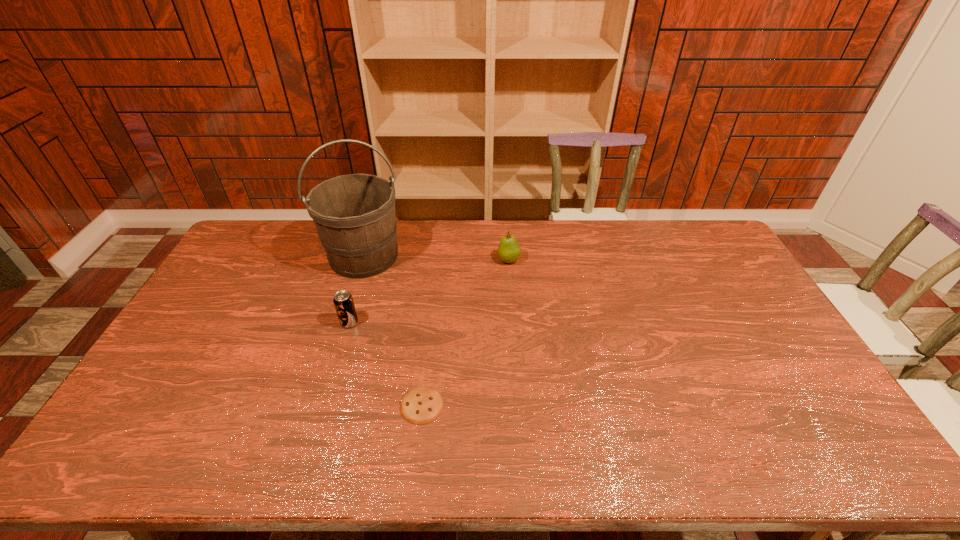
The height and width of the screenshot is (540, 960). I want to click on empty space that is in between the tallest object and the soda can, so click(357, 289).

Where is `vacant area that lies between the third farthest object and the third object from left to right`? The image size is (960, 540). vacant area that lies between the third farthest object and the third object from left to right is located at coordinates click(x=386, y=364).

You are a GUI agent. You are given a task and a screenshot of the screen. Output one action in this format:
    pyautogui.click(x=<x>, y=<y>)
    Task: Click on the vacant space in between the pear and the nearest object
    This screenshot has width=960, height=540.
    Given the screenshot: What is the action you would take?
    pyautogui.click(x=466, y=333)

Identify the location of free area in between the tallest object and the rightmost object. (437, 258).

Locate an element on the screen. vacant region between the shortest object and the tallest object is located at coordinates (393, 330).

The image size is (960, 540). I want to click on empty space that is in between the nearest object and the bucket, so click(x=393, y=330).

The height and width of the screenshot is (540, 960). In order to click on free space between the pear and the tallest object in this screenshot , I will do `click(437, 258)`.

Select which object is the second closest to the second object from right to left. Please provide its 2D coordinates. Your answer should be formatted as a tuple, i.e. [(x, y)], where the tuple contains the x and y coordinates of a point satisfying the conditions above.

[(354, 214)]

Select which object is the third closest to the cookie. Please provide its 2D coordinates. Your answer should be formatted as a tuple, i.e. [(x, y)], where the tuple contains the x and y coordinates of a point satisfying the conditions above.

[(509, 251)]

This screenshot has width=960, height=540. I want to click on vacant space that satisfies the following two spatial constraints: 1. on the back side of the soda can; 2. on the right side of the pear, so click(x=368, y=260).